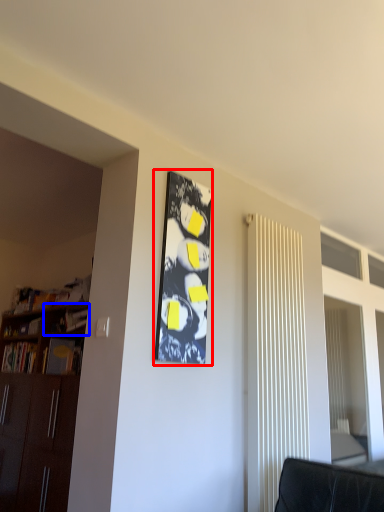
Question: Which point is further to the camera, bulletin board (highlighted by a red box) or shelf (highlighted by a blue box)?

Choices:
 (A) bulletin board
 (B) shelf

Answer: (B)